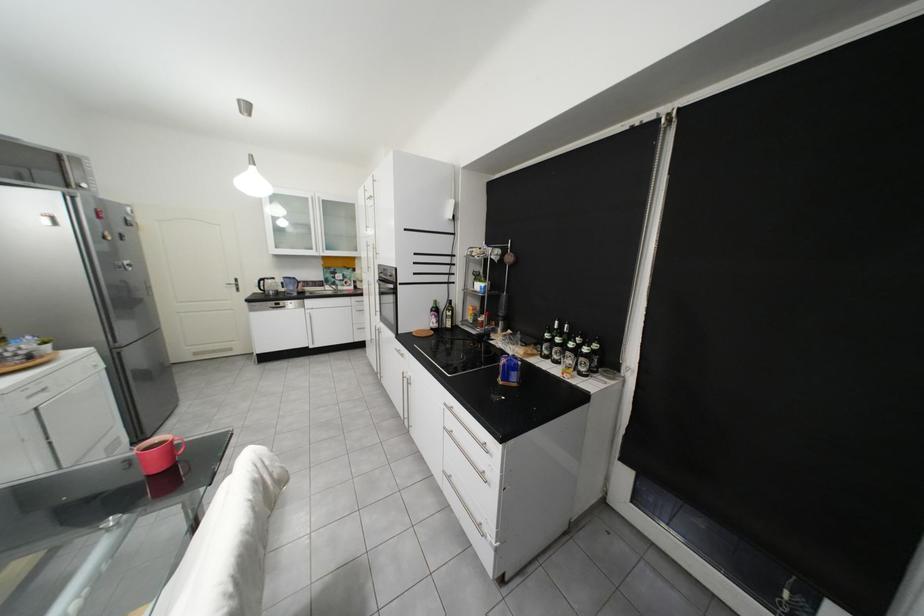
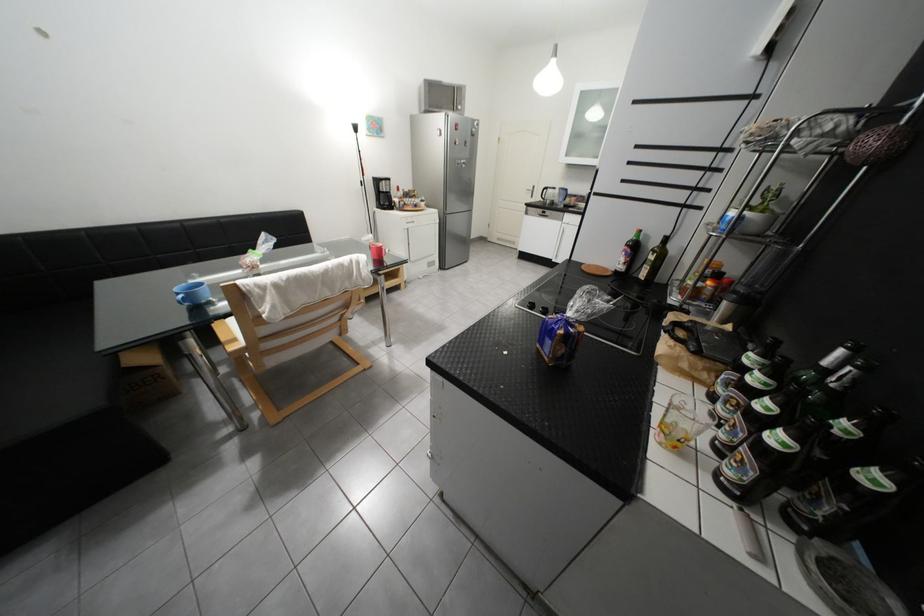
Find the pixel in the second image that matches the point at 274,281 in the first image.

(557, 190)